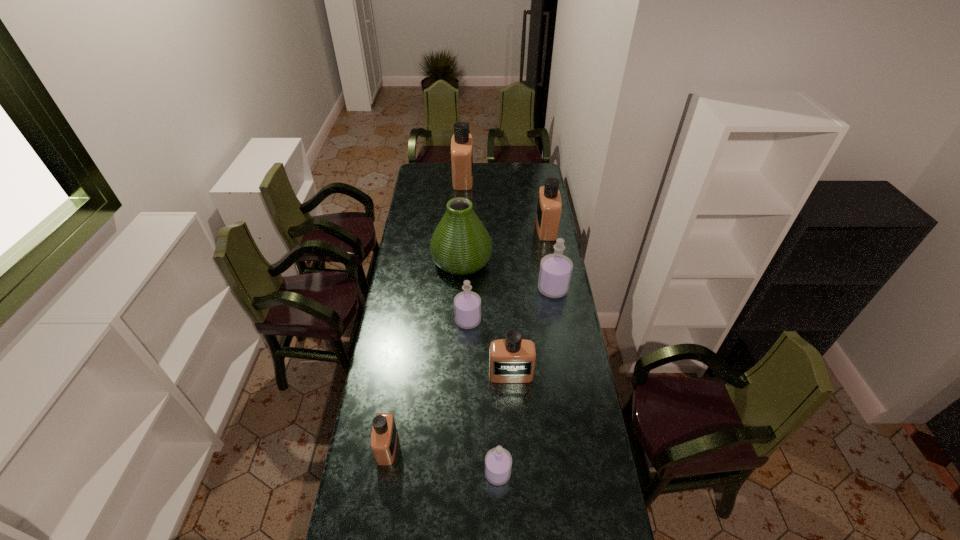
Locate an element on the screen. This screenshot has width=960, height=540. beige perfume object that ranks as the third closest to the fourth farthest perfume is located at coordinates tap(549, 206).

What are the coordinates of `purple perfume that is the closest to the second purple perfume from left to right` in the screenshot? It's located at (467, 305).

Select which purple perfume appears as the closest to the farthest beige perfume. Please provide its 2D coordinates. Your answer should be formatted as a tuple, i.e. [(x, y)], where the tuple contains the x and y coordinates of a point satisfying the conditions above.

[(555, 273)]

Locate an element on the screen. free space in the image that satisfies the following two spatial constraints: 1. on the back side of the leftmost purple perfume; 2. on the front label of the second beige perfume from left to right is located at coordinates (471, 179).

Where is `free space that satisfies the following two spatial constraints: 1. on the front label of the third nearest object; 2. on the front label of the nearest beige perfume`? This screenshot has height=540, width=960. free space that satisfies the following two spatial constraints: 1. on the front label of the third nearest object; 2. on the front label of the nearest beige perfume is located at coordinates (516, 447).

Where is `vacant area in the image that satisfies the following two spatial constraints: 1. on the front label of the third smallest beige perfume; 2. on the front side of the vase`? vacant area in the image that satisfies the following two spatial constraints: 1. on the front label of the third smallest beige perfume; 2. on the front side of the vase is located at coordinates (552, 261).

This screenshot has width=960, height=540. What are the coordinates of `free space that satisfies the following two spatial constraints: 1. on the front label of the farthest purple perfume; 2. on the left side of the farthest beige perfume` in the screenshot? It's located at (457, 289).

Locate an element on the screen. vacant space that satisfies the following two spatial constraints: 1. on the front label of the rightmost beige perfume; 2. on the front side of the nearest purple perfume is located at coordinates (589, 473).